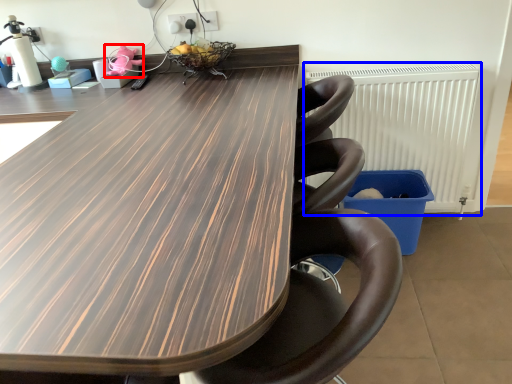
Question: Which of the following is the closest to the observer, toy (highlighted by a red box) or radiator (highlighted by a blue box)?

Choices:
 (A) toy
 (B) radiator

Answer: (B)